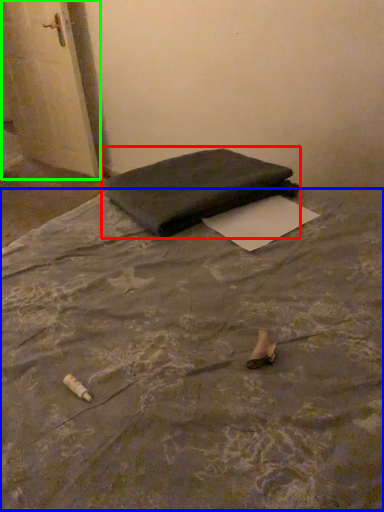
Question: Which object is the closest to the furniture (highlighted by a red box)? Choose among these: mattress (highlighted by a blue box) or door (highlighted by a green box).

Choices:
 (A) mattress
 (B) door

Answer: (A)